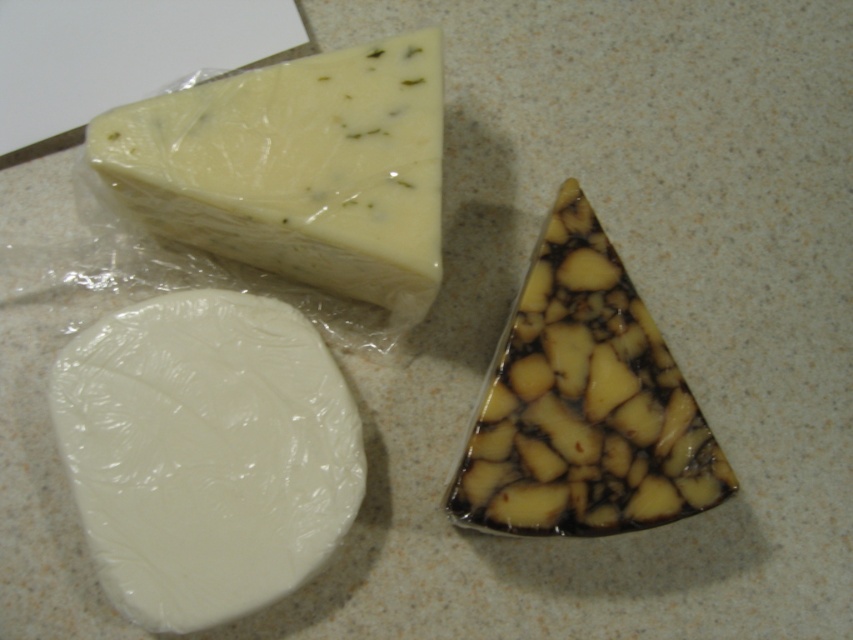
You are standing in front of the three cheeses on the countertop. Which point, point 1 at coordinates (374, 230) or point 2 at coordinates (502, 365), is closer to you?

Point 1 at coordinates (374, 230) is closer to you because it is in front of point 2 at coordinates (502, 365).